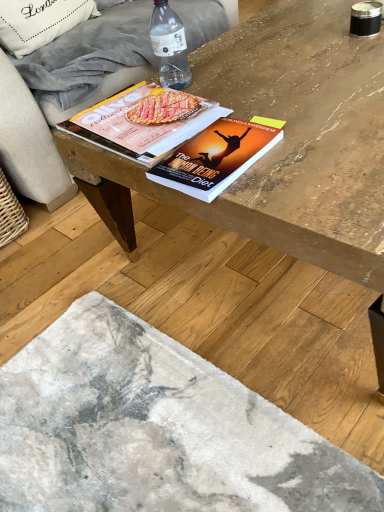
This screenshot has height=512, width=384. Describe the element at coordinates (215, 157) in the screenshot. I see `hardcover book at center, acting as the second book starting from the back` at that location.

Consider the image. What is the approximate width of beige fabric couch at upper left?

beige fabric couch at upper left is 3.83 feet in width.

Find the location of a particular element. This screenshot has height=512, width=384. transparent plastic bottle at upper center is located at coordinates (169, 46).

This screenshot has height=512, width=384. What do you see at coordinates (39, 22) in the screenshot?
I see `white fabric pillow at upper left` at bounding box center [39, 22].

Measure the distance between wooden table at center and camera.

The distance of wooden table at center from camera is 28.93 inches.

Consider the image. Measure the distance between point (133, 136) and camera.

Point (133, 136) and camera are 35.31 inches apart.

This screenshot has width=384, height=512. What do you see at coordinates (145, 122) in the screenshot?
I see `matte paper magazine at center, which is the 2th book from front to back` at bounding box center [145, 122].

The height and width of the screenshot is (512, 384). I want to click on hardcover book at center, acting as the second book starting from the back, so click(215, 157).

Does transparent plastic bottle at upper center come behind wooden table at center?

Yes.

From the image's perspective, is transparent plastic bottle at upper center located above or below wooden table at center?

transparent plastic bottle at upper center is situated higher than wooden table at center in the image.

Looking at this image, is transparent plastic bottle at upper center inside the boundaries of wooden table at center, or outside?

transparent plastic bottle at upper center is outside wooden table at center.

Considering the positions of point (165, 5) and point (326, 444), is point (165, 5) closer or farther from the camera than point (326, 444)?

Clearly, point (165, 5) is more distant from the camera than point (326, 444).

Which of these two, transparent plastic bottle at upper center or beige fabric couch at upper left, stands shorter?

With less height is transparent plastic bottle at upper center.

Is the depth of transparent plastic bottle at upper center less than that of beige fabric couch at upper left?

Yes, the depth of transparent plastic bottle at upper center is less than that of beige fabric couch at upper left.

From the image's perspective, between transparent plastic bottle at upper center and beige fabric couch at upper left, who is located below?

transparent plastic bottle at upper center is shown below in the image.

From their relative heights in the image, would you say wooden coffee table at center is taller or shorter than transparent plastic bottle at upper center?

wooden coffee table at center is taller than transparent plastic bottle at upper center.

Which of these two, wooden coffee table at center or transparent plastic bottle at upper center, is bigger?

With larger size is wooden coffee table at center.

Based on the photo, which is more to the left, wooden coffee table at center or transparent plastic bottle at upper center?

From the viewer's perspective, transparent plastic bottle at upper center appears more on the left side.

Can you confirm if beige fabric couch at upper left is wider than transparent plastic bottle at upper center?

Indeed, beige fabric couch at upper left has a greater width compared to transparent plastic bottle at upper center.

Does point (39, 146) come behind point (153, 18)?

No, it is not.

Locate an element on the screen. The height and width of the screenshot is (512, 384). studio couch located behind the transparent plastic bottle at upper center is located at coordinates (45, 131).

Measure the distance between beige fabric couch at upper left and transparent plastic bottle at upper center.

beige fabric couch at upper left is 18.88 inches away from transparent plastic bottle at upper center.

Which point is more forward, (162,162) or (174,69)?

The point (162,162) is in front.

Is hardcover book at center, acting as the second book starting from the back, completely or partially outside of transparent plastic bottle at upper center?

Yes, hardcover book at center, acting as the second book starting from the back, is outside of transparent plastic bottle at upper center.

The height and width of the screenshot is (512, 384). I want to click on bottle that appears behind the hardcover book at center, acting as the second book starting from the back, so click(169, 46).

From a real-world perspective, does white fabric pillow at upper left stand above wooden table at center?

Indeed, from a real-world perspective, white fabric pillow at upper left stands above wooden table at center.

How much distance is there between white fabric pillow at upper left and wooden table at center?

white fabric pillow at upper left is 1.37 meters from wooden table at center.

Considering the relative sizes of white fabric pillow at upper left and wooden table at center in the image provided, is white fabric pillow at upper left taller than wooden table at center?

Indeed, white fabric pillow at upper left has a greater height compared to wooden table at center.

Is white fabric pillow at upper left looking in the opposite direction of wooden table at center?

No.

Which of these two, transparent plastic bottle at upper center or hardcover book at center, arranged as the 1th book when viewed from the front, is bigger?

With larger size is transparent plastic bottle at upper center.

From the image's perspective, is transparent plastic bottle at upper center over hardcover book at center, arranged as the 1th book when viewed from the front?

Answer: Yes.

Could you tell me if transparent plastic bottle at upper center is facing hardcover book at center, acting as the second book starting from the back?

No, transparent plastic bottle at upper center is not aimed at hardcover book at center, acting as the second book starting from the back.

Is transparent plastic bottle at upper center thinner than hardcover book at center, arranged as the 1th book when viewed from the front?

Correct, the width of transparent plastic bottle at upper center is less than that of hardcover book at center, arranged as the 1th book when viewed from the front.

Find the location of `bottle located behind the wooden table at center`. bottle located behind the wooden table at center is located at coordinates (169, 46).

Where is `studio couch that is above the transparent plastic bottle at upper center (from the image's perspective)`? The width and height of the screenshot is (384, 512). studio couch that is above the transparent plastic bottle at upper center (from the image's perspective) is located at coordinates (45, 131).

From the image, which object appears to be nearer to matte paper magazine at center, marked as the first book in a back-to-front arrangement, white fabric pillow at upper left or transparent plastic bottle at upper center?

The object closer to matte paper magazine at center, marked as the first book in a back-to-front arrangement, is transparent plastic bottle at upper center.

Looking at this image, when comparing their distances from matte paper magazine at center, which is the 2th book from front to back, does white fabric pillow at upper left or beige fabric couch at upper left seem closer?

beige fabric couch at upper left is positioned closer to the anchor matte paper magazine at center, which is the 2th book from front to back.

When comparing their distances from transparent plastic bottle at upper center, does wooden table at center or beige fabric couch at upper left seem further?

Among the two, wooden table at center is located further to transparent plastic bottle at upper center.

Looking at the image, which one is located further to hardcover book at center, arranged as the 1th book when viewed from the front, wooden coffee table at center or transparent plastic bottle at upper center?

Based on the image, transparent plastic bottle at upper center appears to be further to hardcover book at center, arranged as the 1th book when viewed from the front.

Based on their spatial positions, is beige fabric couch at upper left or wooden coffee table at center closer to white fabric pillow at upper left?

Based on the image, beige fabric couch at upper left appears to be nearer to white fabric pillow at upper left.

Which object lies nearer to the anchor point matte paper magazine at center, which is the 2th book from front to back, beige fabric couch at upper left or hardcover book at center, arranged as the 1th book when viewed from the front?

hardcover book at center, arranged as the 1th book when viewed from the front, lies closer to matte paper magazine at center, which is the 2th book from front to back, than the other object.

From the picture: Based on their spatial positions, is hardcover book at center, arranged as the 1th book when viewed from the front, or wooden coffee table at center closer to matte paper magazine at center, which is the 2th book from front to back?

hardcover book at center, arranged as the 1th book when viewed from the front, lies closer to matte paper magazine at center, which is the 2th book from front to back, than the other object.

Looking at the image, which one is located closer to wooden coffee table at center, beige fabric couch at upper left or matte paper magazine at center, which is the 2th book from front to back?

The object closer to wooden coffee table at center is matte paper magazine at center, which is the 2th book from front to back.

Locate an element on the screen. The image size is (384, 512). studio couch located between transparent plastic bottle at upper center and white fabric pillow at upper left in the depth direction is located at coordinates (45, 131).

The height and width of the screenshot is (512, 384). What are the coordinates of `bottle located between beige fabric couch at upper left and wooden coffee table at center in the left-right direction` in the screenshot? It's located at (169, 46).

At what (x,y) coordinates should I click in order to perform the action: click on bottle between beige fabric couch at upper left and matte paper magazine at center, marked as the first book in a back-to-front arrangement, in the vertical direction. Please return your answer as a coordinate pair (x, y). Looking at the image, I should click on (169, 46).

Locate an element on the screen. bottle between beige fabric couch at upper left and wooden table at center in the up-down direction is located at coordinates (x=169, y=46).